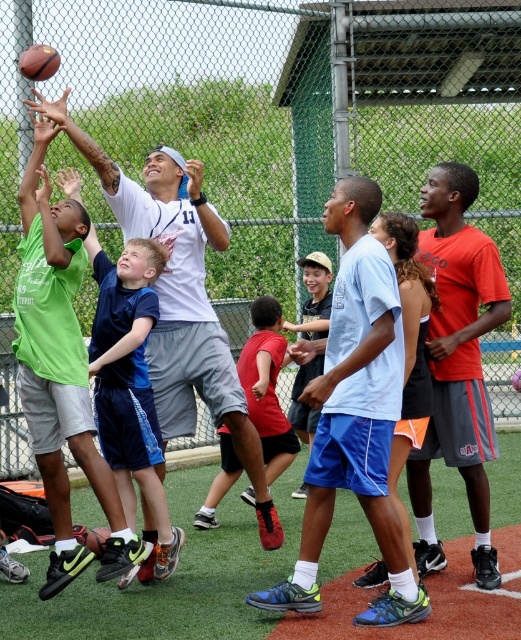
Question: Is light blue fabric shirt at center wider than orange cotton shirt at right?

Choices:
 (A) no
 (B) yes

Answer: (B)

Question: Does light blue fabric shirt at center have a larger size compared to orange cotton shirt at right?

Choices:
 (A) no
 (B) yes

Answer: (B)

Question: Among these points, which one is farthest from the camera?

Choices:
 (A) (287, 360)
 (B) (158, 442)
 (C) (317, 280)

Answer: (C)

Question: Based on their relative distances, which object is farther from the light blue shorts at center?

Choices:
 (A) rubber textured basketball at center
 (B) rubber textured basketball at upper left

Answer: (B)

Question: Does light blue fabric shirt at center appear on the right side of white matte t-shirt at upper center?

Choices:
 (A) yes
 (B) no

Answer: (A)

Question: Which point is closer to the camera?

Choices:
 (A) (206, 513)
 (B) (403, 385)

Answer: (B)